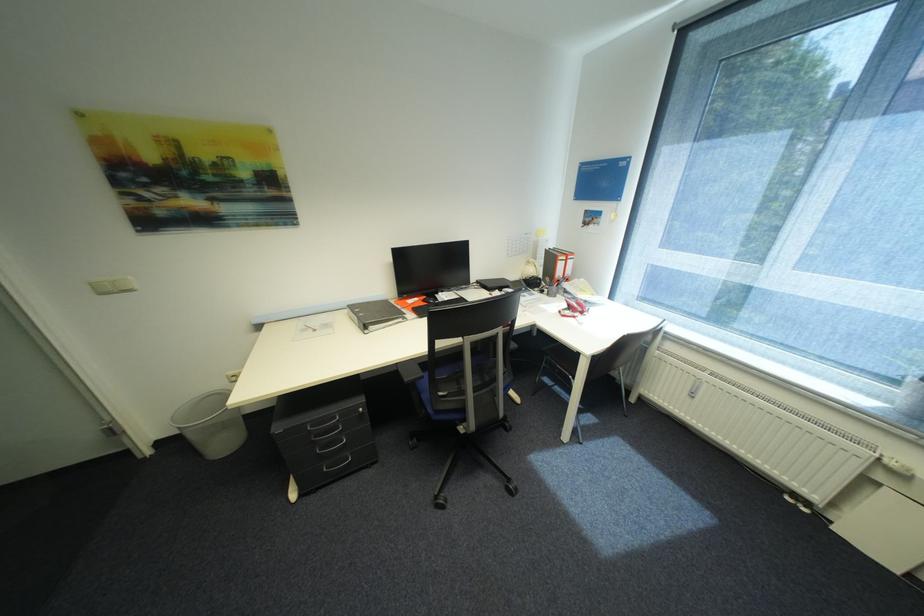
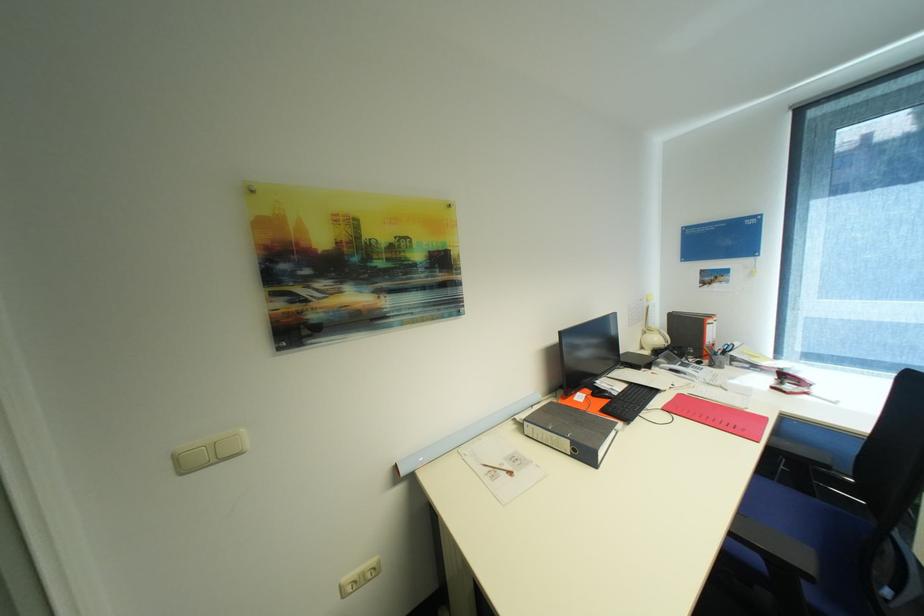
Where in the second image is the point corresponding to pixel 576 313 from the first image?

(796, 387)